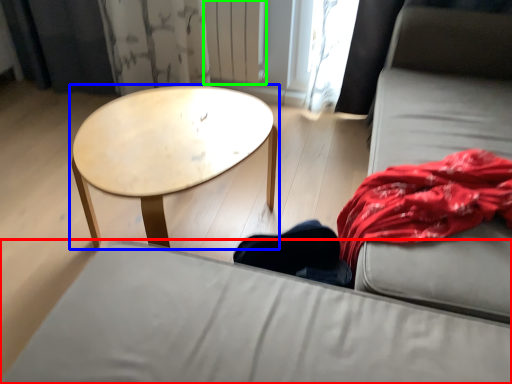
Question: Considering the real-world distances, which object is closest to studio couch (highlighted by a red box)? coffee table (highlighted by a blue box) or radiator (highlighted by a green box).

Choices:
 (A) coffee table
 (B) radiator

Answer: (A)